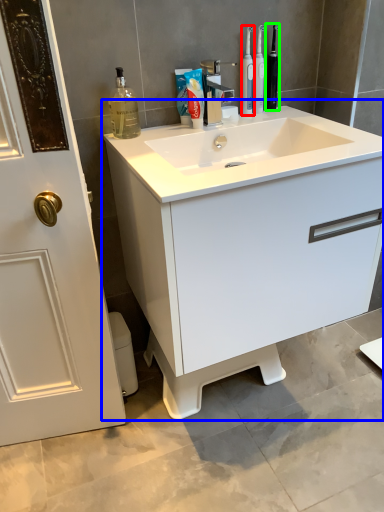
Question: Considering the real-world distances, which object is farthest from mouthwash (highlighted by a red box)? bathroom cabinet (highlighted by a blue box) or toiletry (highlighted by a green box)?

Choices:
 (A) bathroom cabinet
 (B) toiletry

Answer: (A)